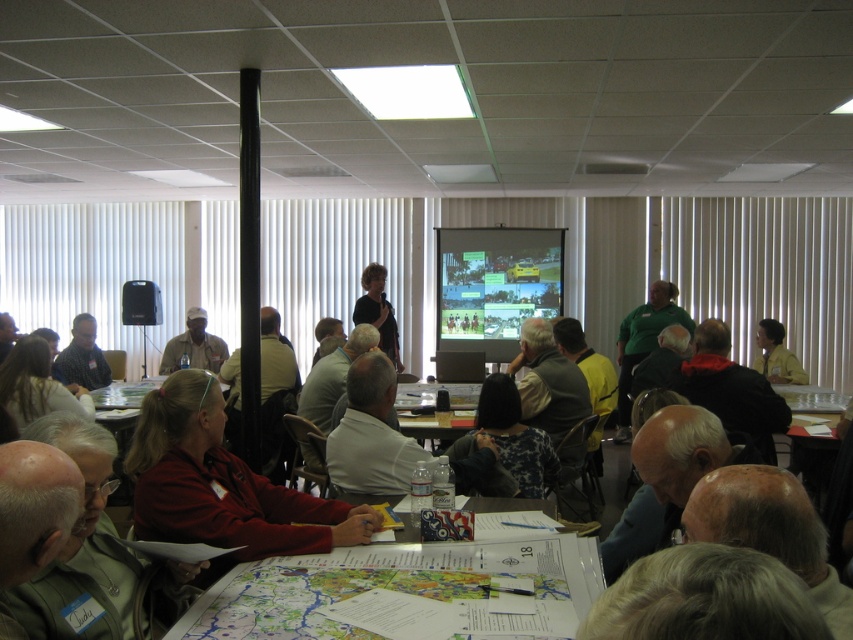
Question: Which object appears closest to the camera in this image?

Choices:
 (A) matte plastic projector screen at center
 (B) matte khaki shirt at center
 (C) dark blue patterned shirt at center

Answer: (C)

Question: Considering the relative positions of matte plastic projector screen at center and matte black shirt at center in the image provided, where is matte plastic projector screen at center located with respect to matte black shirt at center?

Choices:
 (A) above
 (B) below

Answer: (A)

Question: Does matte khaki shirt at center have a smaller size compared to dark blue shirt at lower left?

Choices:
 (A) yes
 (B) no

Answer: (A)

Question: Which point is farther from the camera taking this photo?

Choices:
 (A) (375, 314)
 (B) (20, 595)
 (C) (48, 406)
 (D) (227, 353)

Answer: (D)

Question: Which of the following is the closest to the observer?

Choices:
 (A) click(x=426, y=436)
 (B) click(x=541, y=486)

Answer: (B)

Question: Does red matte shirt at lower left have a smaller size compared to wooden table at center?

Choices:
 (A) yes
 (B) no

Answer: (A)